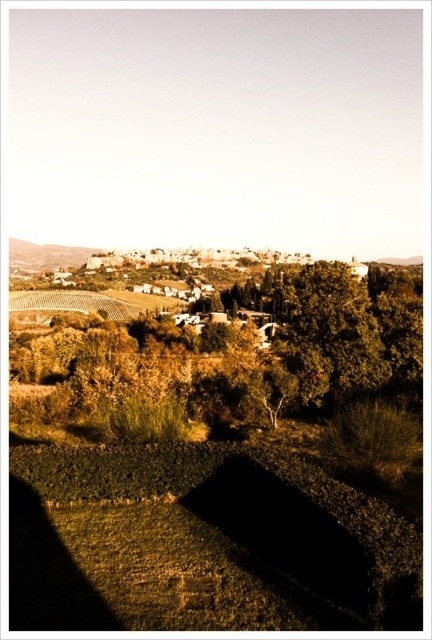
Is green leafy tree at center shorter than earthy brown stone wall at upper left?

Correct, green leafy tree at center is not as tall as earthy brown stone wall at upper left.

Who is more forward, (116, 314) or (38, 268)?

Positioned in front is point (116, 314).

Which is behind, point (162, 337) or point (38, 262)?

The point (38, 262) is more distant.

In order to click on green leafy tree at center in this screenshot , I will do (219, 349).